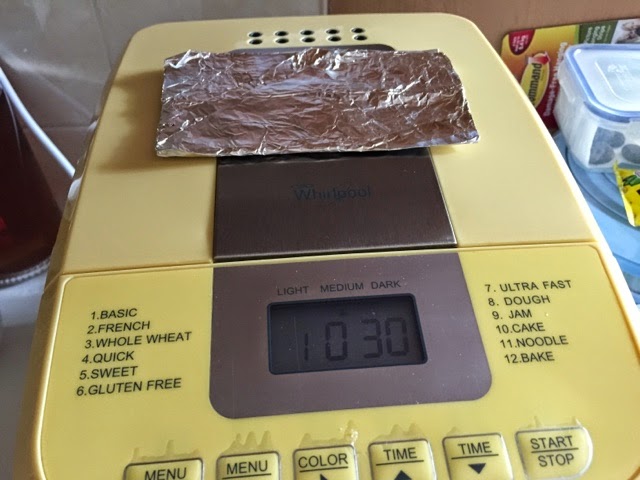
You are a GUI agent. You are given a task and a screenshot of the screen. Output one action in this format:
    pyautogui.click(x=<x>, y=<y>)
    Task: Click on the plastic storage container
    This screenshot has height=480, width=640.
    Given the screenshot: What is the action you would take?
    pyautogui.click(x=587, y=96)